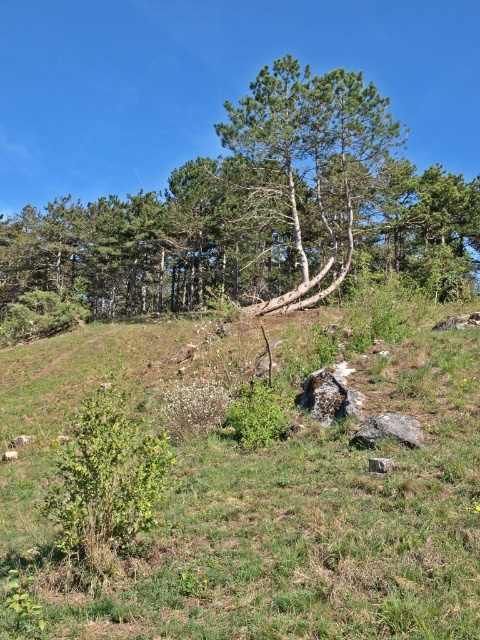
Question: Which of the following is the closest to the observer?

Choices:
 (A) gray rough rock at lower center
 (B) gray rough stone at center

Answer: (B)

Question: Which point is closer to the camera taking this photo?

Choices:
 (A) (452, 189)
 (B) (213, 541)
 (C) (346, 264)

Answer: (B)

Question: Can you confirm if green grassy at center is thinner than green textured tree at center?

Choices:
 (A) no
 (B) yes

Answer: (A)

Question: From the image, what is the correct spatial relationship of green leafy pine forest at center in relation to gray rough stone at center?

Choices:
 (A) above
 (B) below

Answer: (A)

Question: Considering the real-world distances, which object is farthest from the green leafy pine forest at center?

Choices:
 (A) gray rough stone at center
 (B) green grassy at center

Answer: (A)

Question: Does green grassy at center appear over green textured tree at center?

Choices:
 (A) no
 (B) yes

Answer: (A)